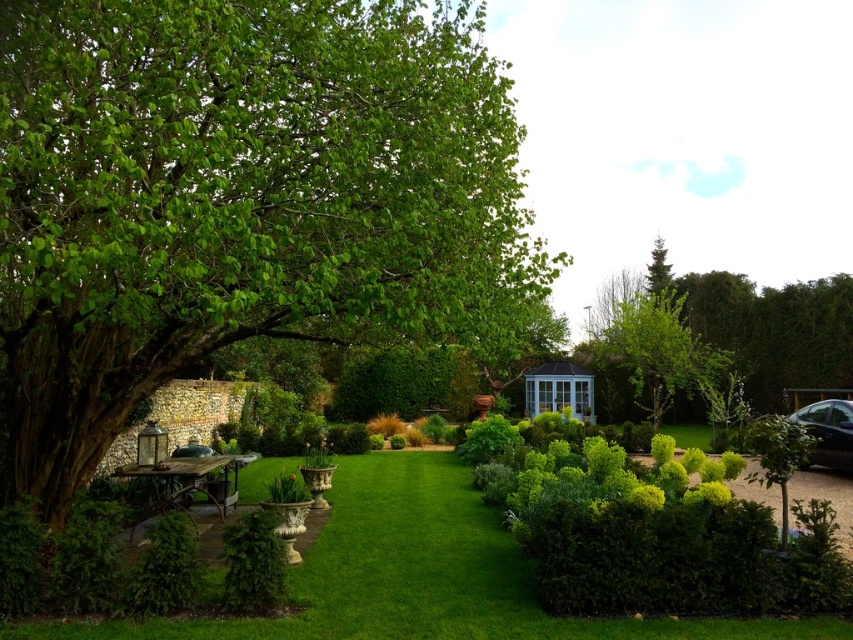
Question: Is green leafy tree at center-right bigger than black glossy car at lower right?

Choices:
 (A) no
 (B) yes

Answer: (B)

Question: Does green leafy tree at upper right have a larger size compared to green leafy tree at center-right?

Choices:
 (A) no
 (B) yes

Answer: (B)

Question: Which point is farther to the camera?

Choices:
 (A) (836, 400)
 (B) (810, 380)
 (C) (144, 468)
 (D) (596, 358)

Answer: (D)

Question: Can you confirm if green leafy tree at upper right is positioned below green leafy tree at center-right?

Choices:
 (A) yes
 (B) no

Answer: (B)

Question: Among these objects, which one is farthest from the camera?

Choices:
 (A) green leafy tree at center-right
 (B) green leafy tree at left
 (C) green leafy hedge at center
 (D) rustic wood picnic table at lower left

Answer: (A)

Question: Among these objects, which one is nearest to the camera?

Choices:
 (A) green leafy tree at center-right
 (B) green leafy hedge at center

Answer: (B)